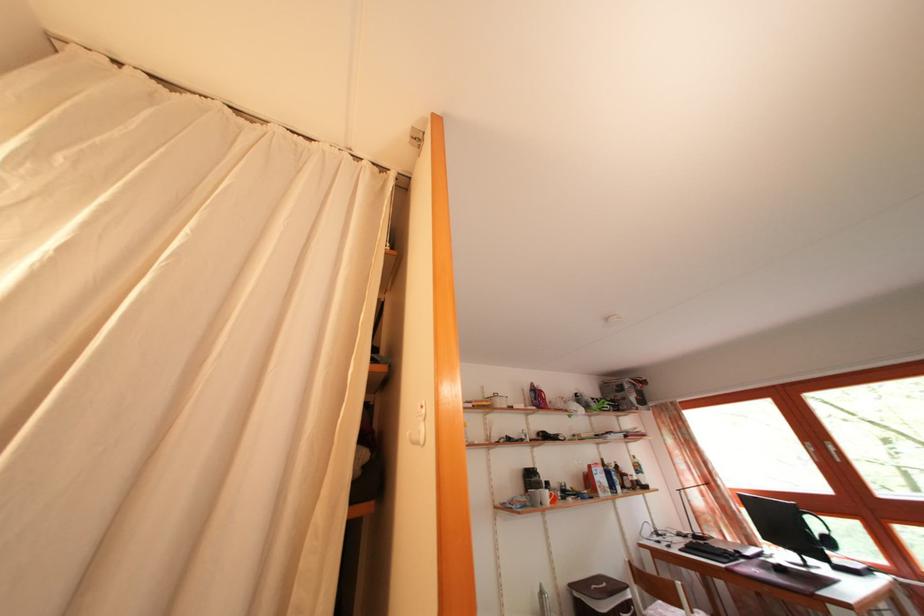
Which object does [419,427] point to?

It corresponds to the white wall hook in the image.